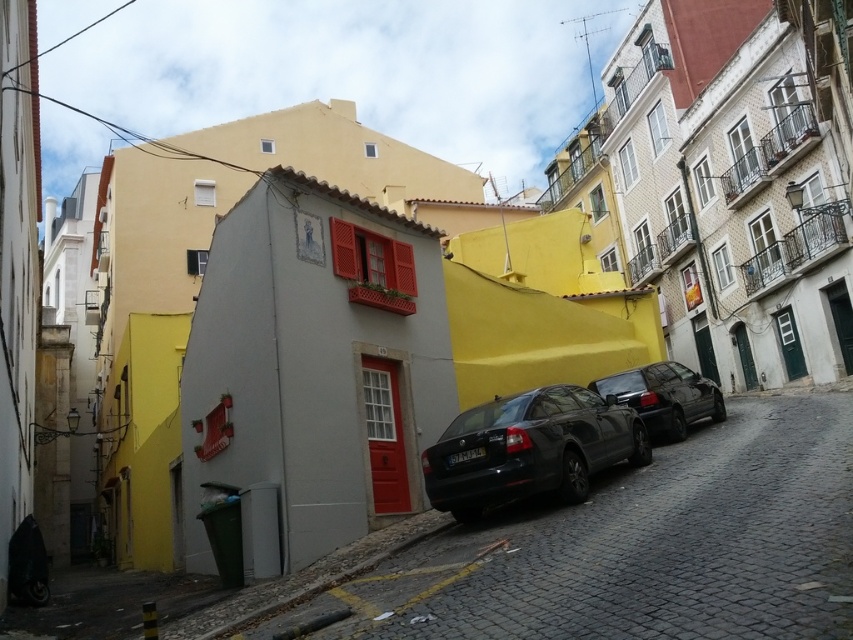
You are standing on the cobblestone road in the urban scene. There is a point marked at coordinates [637,548]. What is the color of the surface where this point is located?

The point is on a smooth gray wall at center.

You are a painter who wants to paint the smooth gray wall at center and the matte black car at center. Which object requires a longer ladder to paint its top surface?

The matte black car at center requires a longer ladder because the smooth gray wall at center is not as tall as the matte black car at center, meaning the car is taller.